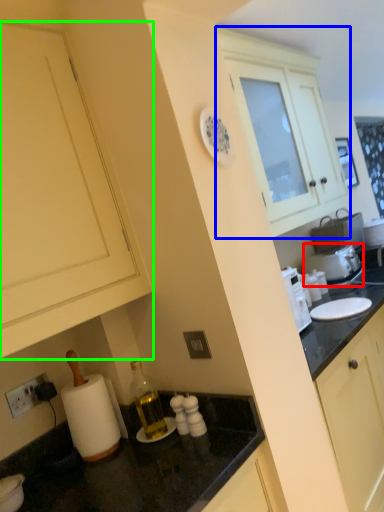
Question: Estimate the real-world distances between objects in this image. Which object is closer to appliance (highlighted by a red box), cabinetry (highlighted by a blue box) or cabinetry (highlighted by a green box)?

Choices:
 (A) cabinetry
 (B) cabinetry

Answer: (A)